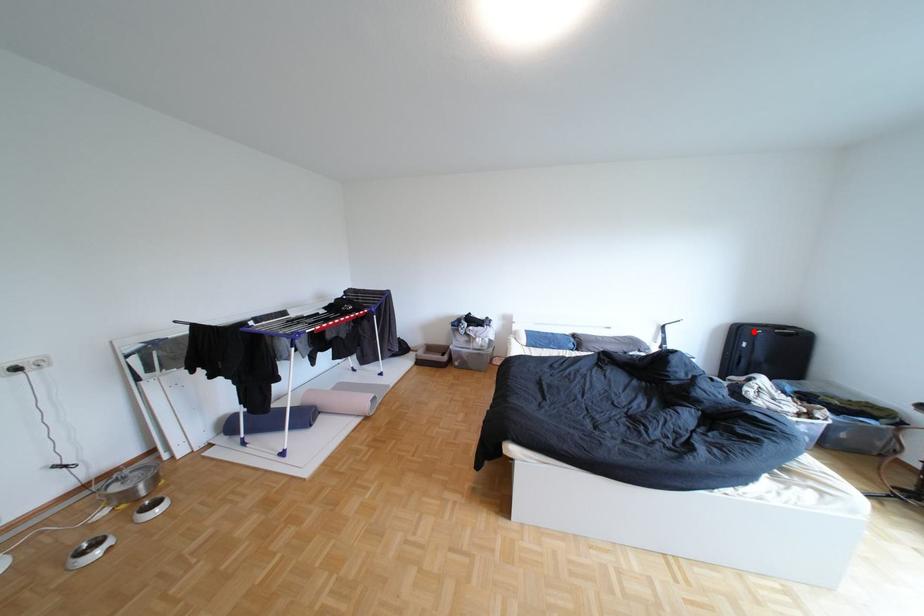
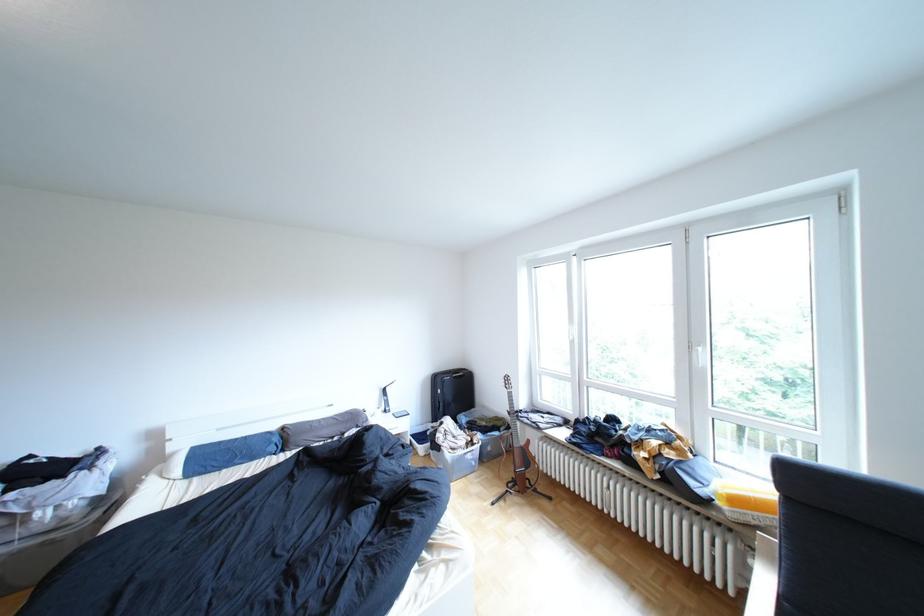
The point at the highlighted location is marked in the first image. Where is the corresponding point in the second image?

(452, 379)